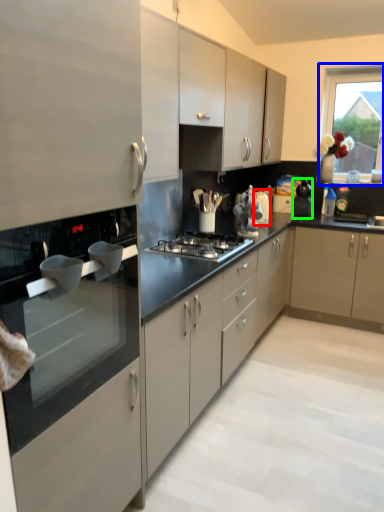
Question: Which object is positioned closest to appliance (highlighted by a red box)? Select from window (highlighted by a blue box) and kitchen appliance (highlighted by a green box).

Choices:
 (A) window
 (B) kitchen appliance

Answer: (B)